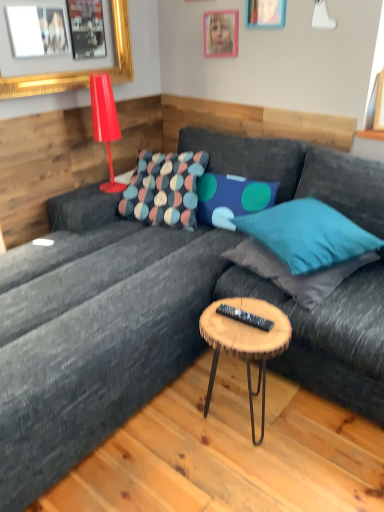
What do you see at coordinates (105, 122) in the screenshot?
I see `shiny red lamp at upper left` at bounding box center [105, 122].

Locate an element on the screen. Image resolution: width=384 pixels, height=512 pixels. teal fabric pillow at right, the 4th pillow when ordered from left to right is located at coordinates (295, 275).

What do you see at coordinates (221, 33) in the screenshot? This screenshot has height=512, width=384. I see `pink plastic picture frame at upper center, marked as the second picture frame in a left-to-right arrangement` at bounding box center [221, 33].

What is the approximate width of black plastic remote at center?

2.31 inches.

In the scene shown: How much space does blue fabric pillow at center, which is counted as the 2th pillow, starting from the left, occupy vertically?

blue fabric pillow at center, which is counted as the 2th pillow, starting from the left, is 12.00 inches tall.

Locate an element on the screen. The image size is (384, 512). shiny red lamp at upper left is located at coordinates (105, 122).

In the scene shown: Is teal fabric pillow at right, the 4th pillow when ordered from left to right, wider or thinner than pink plastic picture frame at upper center, marked as the second picture frame in a left-to-right arrangement?

Considering their sizes, teal fabric pillow at right, the 4th pillow when ordered from left to right, looks broader than pink plastic picture frame at upper center, marked as the second picture frame in a left-to-right arrangement.

Is the depth of teal fabric pillow at right, the 4th pillow when ordered from left to right, less than that of pink plastic picture frame at upper center, marked as the second picture frame in a left-to-right arrangement?

Yes, it is.

Is pink plastic picture frame at upper center, marked as the second picture frame in a left-to-right arrangement, surrounded by teal fabric pillow at right, the 4th pillow when ordered from left to right?

No.

Is wooden picture frame at upper center, which is the third picture frame from left to right, at the right side of gold framed picture at upper left, the 3th picture frame when ordered from right to left?

Yes.

From the image's perspective, which is above, wooden picture frame at upper center, marked as the 1th picture frame in a right-to-left arrangement, or gold framed picture at upper left, arranged as the first picture frame when viewed from the left?

wooden picture frame at upper center, marked as the 1th picture frame in a right-to-left arrangement, appears higher in the image.

Is the position of wooden picture frame at upper center, marked as the 1th picture frame in a right-to-left arrangement, less distant than that of gold framed picture at upper left, arranged as the first picture frame when viewed from the left?

No, it is behind gold framed picture at upper left, arranged as the first picture frame when viewed from the left.

From a real-world perspective, which is physically above, wooden picture frame at upper center, marked as the 1th picture frame in a right-to-left arrangement, or gold framed picture at upper left, arranged as the first picture frame when viewed from the left?

wooden picture frame at upper center, marked as the 1th picture frame in a right-to-left arrangement.

From the image's perspective, which is above, gold framed picture at upper left, the 3th picture frame when ordered from right to left, or textured multicolored pillow at center, arranged as the 1th pillow when viewed from the left?

gold framed picture at upper left, the 3th picture frame when ordered from right to left.

Considering the sizes of gold framed picture at upper left, the 3th picture frame when ordered from right to left, and textured multicolored pillow at center, the fourth pillow from the right, in the image, is gold framed picture at upper left, the 3th picture frame when ordered from right to left, wider or thinner than textured multicolored pillow at center, the fourth pillow from the right,?

gold framed picture at upper left, the 3th picture frame when ordered from right to left, is thinner than textured multicolored pillow at center, the fourth pillow from the right.

Are gold framed picture at upper left, the 3th picture frame when ordered from right to left, and textured multicolored pillow at center, the fourth pillow from the right, located far from each other?

Actually, gold framed picture at upper left, the 3th picture frame when ordered from right to left, and textured multicolored pillow at center, the fourth pillow from the right, are a little close together.

Between gold framed picture at upper left, the 3th picture frame when ordered from right to left, and textured multicolored pillow at center, the fourth pillow from the right, which one has larger size?

textured multicolored pillow at center, the fourth pillow from the right.

From a real-world perspective, which is physically below, teal fabric pillow at right, the 4th pillow when ordered from left to right, or teal fabric pillow at upper right, the third pillow positioned from the left?

teal fabric pillow at right, the 4th pillow when ordered from left to right, is physically lower.

At what (x,y) coordinates should I click in order to perform the action: click on the 3rd pillow positioned below the teal fabric pillow at upper right, the 2th pillow in the right-to-left sequence (from a real-world perspective). Please return your answer as a coordinate pair (x, y). Looking at the image, I should click on (295, 275).

Is teal fabric pillow at right, the 4th pillow when ordered from left to right, bigger than teal fabric pillow at upper right, the third pillow positioned from the left?

Incorrect, teal fabric pillow at right, the 4th pillow when ordered from left to right, is not larger than teal fabric pillow at upper right, the third pillow positioned from the left.

From the image's perspective, which is above, blue fabric pillow at center, which is counted as the 3th pillow, starting from the right, or shiny red lamp at upper left?

shiny red lamp at upper left appears higher in the image.

Is point (214, 200) positioned after point (105, 142)?

No, (214, 200) is in front of (105, 142).

Are blue fabric pillow at center, which is counted as the 2th pillow, starting from the left, and shiny red lamp at upper left located far from each other?

No.

Does blue fabric pillow at center, which is counted as the 3th pillow, starting from the right, have a smaller size compared to shiny red lamp at upper left?

No.

Could you tell me if black plastic remote at center is facing blue fabric pillow at center, which is counted as the 3th pillow, starting from the right?

No, black plastic remote at center is not oriented towards blue fabric pillow at center, which is counted as the 3th pillow, starting from the right.

From a real-world perspective, is black plastic remote at center positioned above or below blue fabric pillow at center, which is counted as the 2th pillow, starting from the left?

black plastic remote at center is below blue fabric pillow at center, which is counted as the 2th pillow, starting from the left.

Does point (223, 307) lie in front of point (214, 201)?

Yes.

Is black plastic remote at center positioned before blue fabric pillow at center, which is counted as the 2th pillow, starting from the left?

Yes.

From the image's perspective, relative to blue fabric pillow at center, which is counted as the 3th pillow, starting from the right, is shiny red lamp at upper left above or below?

Based on their image positions, shiny red lamp at upper left is located above blue fabric pillow at center, which is counted as the 3th pillow, starting from the right.

Which object is more forward, shiny red lamp at upper left or blue fabric pillow at center, which is counted as the 3th pillow, starting from the right?

blue fabric pillow at center, which is counted as the 3th pillow, starting from the right, is more forward.

Based on their positions, is shiny red lamp at upper left located to the left or right of blue fabric pillow at center, which is counted as the 2th pillow, starting from the left?

Based on their positions, shiny red lamp at upper left is located to the left of blue fabric pillow at center, which is counted as the 2th pillow, starting from the left.

Considering the relative sizes of shiny red lamp at upper left and blue fabric pillow at center, which is counted as the 2th pillow, starting from the left, in the image provided, is shiny red lamp at upper left taller than blue fabric pillow at center, which is counted as the 2th pillow, starting from the left,?

Yes, shiny red lamp at upper left is taller than blue fabric pillow at center, which is counted as the 2th pillow, starting from the left.

Where is `the 4th pillow positioned below the pink plastic picture frame at upper center, marked as the second picture frame in a left-to-right arrangement (from the image's perspective)`? Image resolution: width=384 pixels, height=512 pixels. the 4th pillow positioned below the pink plastic picture frame at upper center, marked as the second picture frame in a left-to-right arrangement (from the image's perspective) is located at coordinates (295, 275).

There is a wooden picture frame at upper center, marked as the 1th picture frame in a right-to-left arrangement. At what (x,y) coordinates should I click in order to perform the action: click on the 2nd picture frame below it (from a real-world perspective). Please return your answer as a coordinate pair (x, y). Image resolution: width=384 pixels, height=512 pixels. Looking at the image, I should click on (42, 84).

From the image, which object appears to be nearer to woodenmaterial/texturecoffee table at center, wooden picture frame at upper center, marked as the 1th picture frame in a right-to-left arrangement, or teal fabric pillow at right, placed as the 1th pillow when sorted from right to left?

teal fabric pillow at right, placed as the 1th pillow when sorted from right to left.

Estimate the real-world distances between objects in this image. Which object is further from blue fabric pillow at center, which is counted as the 2th pillow, starting from the left, wooden picture frame at upper center, which is the third picture frame from left to right, or woodenmaterial/texturecoffee table at center?

The object further to blue fabric pillow at center, which is counted as the 2th pillow, starting from the left, is wooden picture frame at upper center, which is the third picture frame from left to right.

Based on their spatial positions, is shiny red lamp at upper left or woodenmaterial/texturecoffee table at center further from teal fabric pillow at right, placed as the 1th pillow when sorted from right to left?

shiny red lamp at upper left is further to teal fabric pillow at right, placed as the 1th pillow when sorted from right to left.

Looking at the image, which one is located further to teal fabric pillow at upper right, the 2th pillow in the right-to-left sequence, wooden picture frame at upper center, marked as the 1th picture frame in a right-to-left arrangement, or woodenmaterial/texturecoffee table at center?

wooden picture frame at upper center, marked as the 1th picture frame in a right-to-left arrangement.

Based on their spatial positions, is wooden picture frame at upper center, marked as the 1th picture frame in a right-to-left arrangement, or black plastic remote at center further from teal fabric pillow at upper right, the 2th pillow in the right-to-left sequence?

wooden picture frame at upper center, marked as the 1th picture frame in a right-to-left arrangement, lies further to teal fabric pillow at upper right, the 2th pillow in the right-to-left sequence, than the other object.

When comparing their distances from teal fabric pillow at right, the 4th pillow when ordered from left to right, does gold framed picture at upper left, the 3th picture frame when ordered from right to left, or textured multicolored pillow at center, the fourth pillow from the right, seem further?

gold framed picture at upper left, the 3th picture frame when ordered from right to left, lies further to teal fabric pillow at right, the 4th pillow when ordered from left to right, than the other object.

Considering their positions, is woodenmaterial/texturecoffee table at center positioned further to textured multicolored pillow at center, arranged as the 1th pillow when viewed from the left, than shiny red lamp at upper left?

woodenmaterial/texturecoffee table at center lies further to textured multicolored pillow at center, arranged as the 1th pillow when viewed from the left, than the other object.

Based on their spatial positions, is teal fabric pillow at upper right, the 2th pillow in the right-to-left sequence, or pink plastic picture frame at upper center, the 2th picture frame from the right, further from teal fabric pillow at right, placed as the 1th pillow when sorted from right to left?

pink plastic picture frame at upper center, the 2th picture frame from the right.

Locate an element on the screen. Image resolution: width=384 pixels, height=512 pixels. picture frame between pink plastic picture frame at upper center, the 2th picture frame from the right, and teal fabric pillow at upper right, the third pillow positioned from the left, vertically is located at coordinates (x=42, y=84).

At what (x,y) coordinates should I click in order to perform the action: click on pillow between teal fabric pillow at upper right, the third pillow positioned from the left, and black plastic remote at center vertically. Please return your answer as a coordinate pair (x, y). The height and width of the screenshot is (512, 384). Looking at the image, I should click on (295, 275).

In order to click on pillow between pink plastic picture frame at upper center, the 2th picture frame from the right, and blue fabric pillow at center, which is counted as the 2th pillow, starting from the left, from top to bottom in this screenshot , I will do `click(164, 189)`.

Where is `lamp between wooden picture frame at upper center, which is the third picture frame from left to right, and teal fabric pillow at right, placed as the 1th pillow when sorted from right to left, from top to bottom`? The width and height of the screenshot is (384, 512). lamp between wooden picture frame at upper center, which is the third picture frame from left to right, and teal fabric pillow at right, placed as the 1th pillow when sorted from right to left, from top to bottom is located at coordinates (105, 122).